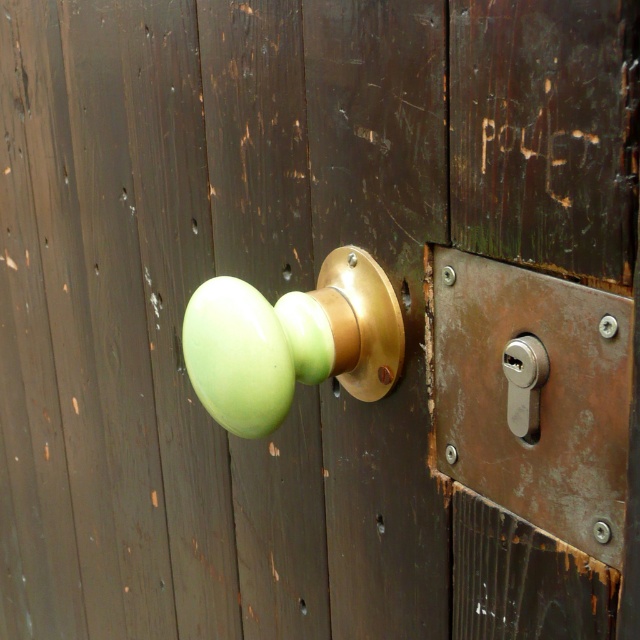
Question: Can you confirm if green matte door handle at center is wider than satin silver lock at right?

Choices:
 (A) no
 (B) yes

Answer: (B)

Question: Which point is farther to the camera?

Choices:
 (A) satin silver lock at right
 (B) green matte door handle at center

Answer: (B)

Question: Which of the following is the closest to the observer?

Choices:
 (A) green matte door handle at center
 (B) satin silver lock at right

Answer: (B)

Question: Can you confirm if green matte door handle at center is positioned to the right of satin silver lock at right?

Choices:
 (A) no
 (B) yes

Answer: (A)

Question: From the image, what is the correct spatial relationship of green matte door handle at center in relation to satin silver lock at right?

Choices:
 (A) below
 (B) above

Answer: (B)